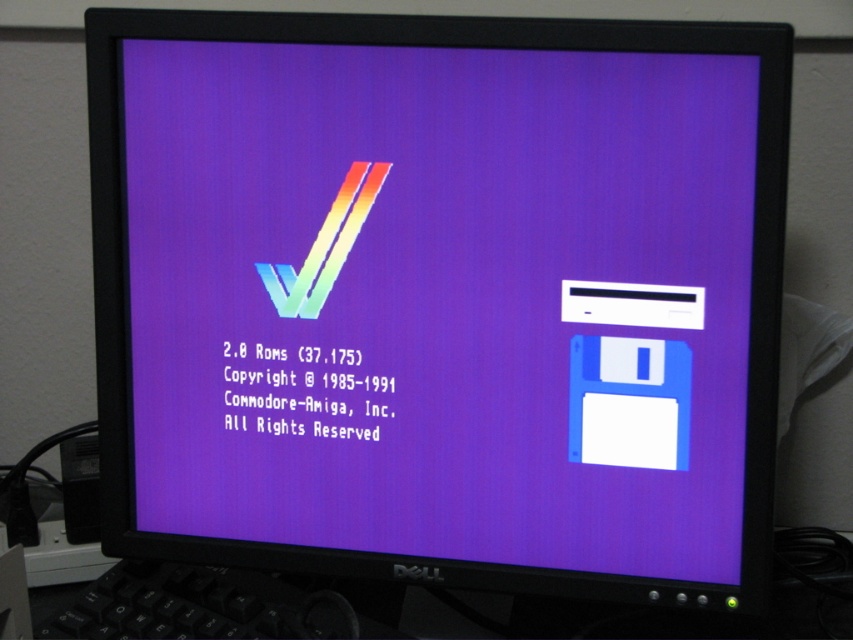
Question: Does matte plastic floppy disk at right appear on the left side of black matte keyboard at lower left?

Choices:
 (A) yes
 (B) no

Answer: (B)

Question: In this image, where is matte plastic floppy disk at right located relative to black matte keyboard at lower left?

Choices:
 (A) left
 (B) right

Answer: (B)

Question: Is matte plastic floppy disk at right to the right of black matte keyboard at lower left from the viewer's perspective?

Choices:
 (A) no
 (B) yes

Answer: (B)